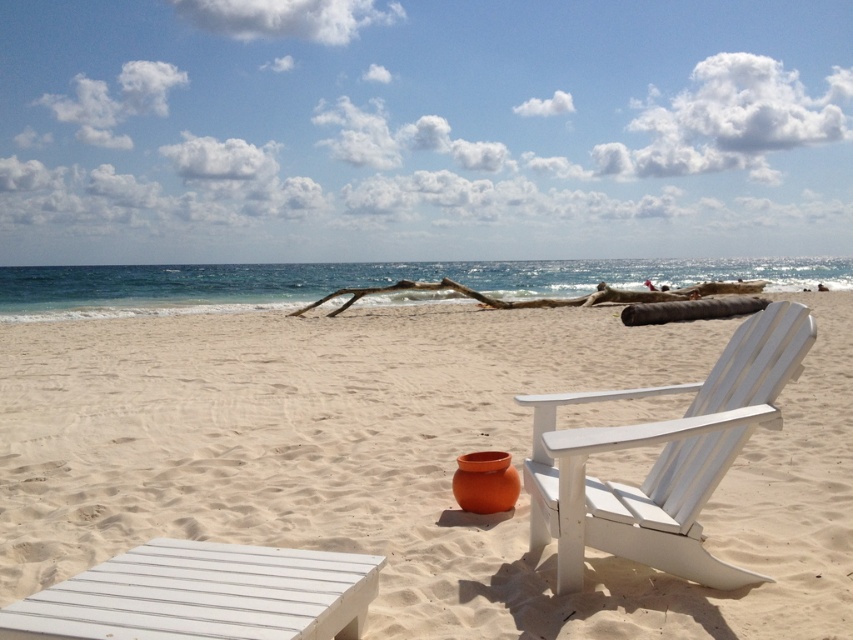
Question: Which point appears closest to the camera in this image?

Choices:
 (A) (186, 385)
 (B) (561, 483)
 (C) (624, 291)

Answer: (B)

Question: Which point is farther from the camera taking this photo?

Choices:
 (A) (608, 524)
 (B) (680, 296)
 (C) (434, 324)

Answer: (B)

Question: Which of these objects is positioned farthest from the white sand at center?

Choices:
 (A) brown wood at center
 (B) white wood beach chair at center right

Answer: (A)

Question: Does white wood beach chair at center right have a larger size compared to brown wood at center?

Choices:
 (A) yes
 (B) no

Answer: (B)

Question: Is white sand at center positioned before white wood beach chair at center right?

Choices:
 (A) yes
 (B) no

Answer: (B)

Question: Does white sand at center appear on the right side of white wood beach chair at center right?

Choices:
 (A) no
 (B) yes

Answer: (B)